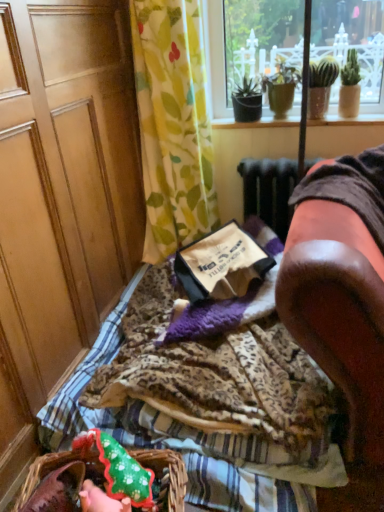
The width and height of the screenshot is (384, 512). I want to click on vacant space situated above green fabric flower basket at lower left (from a real-world perspective), so click(112, 479).